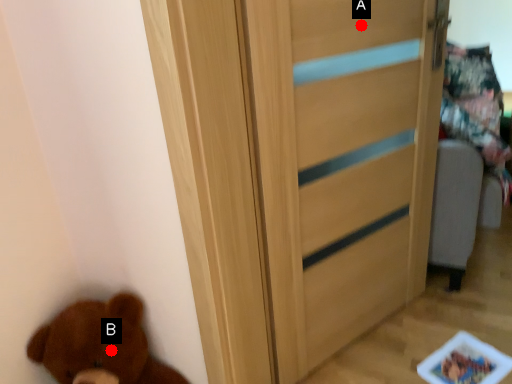
Question: Two points are circled on the image, labeled by A and B beside each circle. Which point is farther from the camera taking this photo?

Choices:
 (A) A is further
 (B) B is further

Answer: (A)